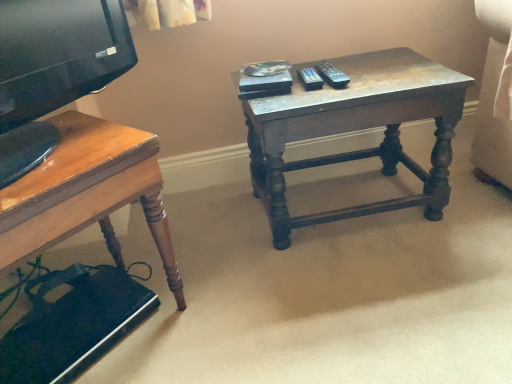
Question: Is wooden desk at lower left to the left or to the right of distressed wood table at center in the image?

Choices:
 (A) right
 (B) left

Answer: (B)

Question: Considering their positions, is wooden desk at lower left located in front of or behind distressed wood table at center?

Choices:
 (A) front
 (B) behind

Answer: (A)

Question: Considering the positions of wooden desk at lower left and distressed wood table at center in the image, is wooden desk at lower left wider or thinner than distressed wood table at center?

Choices:
 (A) thin
 (B) wide

Answer: (B)

Question: From the image's perspective, is distressed wood table at center positioned above or below wooden desk at lower left?

Choices:
 (A) above
 (B) below

Answer: (A)

Question: Relative to wooden desk at lower left, is distressed wood table at center in front or behind?

Choices:
 (A) behind
 (B) front

Answer: (A)

Question: Is point (448, 117) closer or farther from the camera than point (91, 223)?

Choices:
 (A) closer
 (B) farther

Answer: (B)

Question: From a real-world perspective, is distressed wood table at center positioned above or below wooden desk at lower left?

Choices:
 (A) below
 (B) above

Answer: (A)